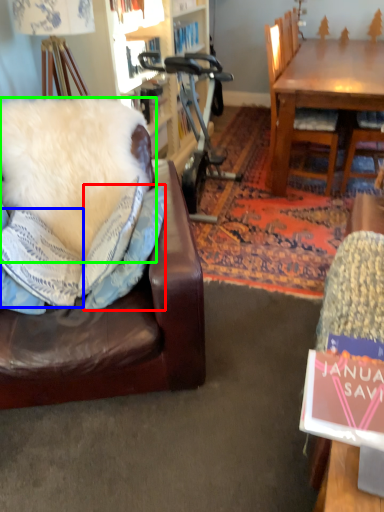
Question: Considering the real-world distances, which object is closest to pillow (highlighted by a red box)? pillow (highlighted by a blue box) or pillow (highlighted by a green box).

Choices:
 (A) pillow
 (B) pillow

Answer: (A)